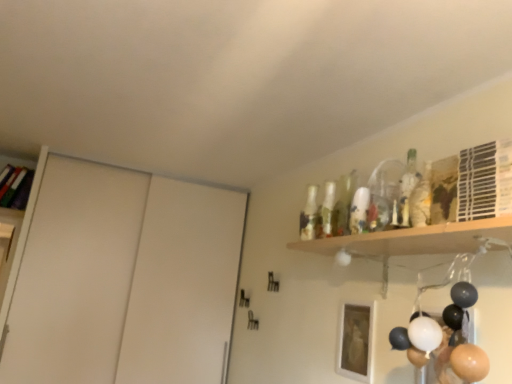
Question: Is white matte picture frame at lower center not inside matte black balloons at lower right?

Choices:
 (A) yes
 (B) no

Answer: (A)

Question: Can you confirm if white matte picture frame at lower center is taller than matte black balloons at lower right?

Choices:
 (A) yes
 (B) no

Answer: (B)

Question: From a real-world perspective, is white matte picture frame at lower center under matte black balloons at lower right?

Choices:
 (A) no
 (B) yes

Answer: (B)

Question: Considering the relative positions of white matte picture frame at lower center and matte black balloons at lower right in the image provided, is white matte picture frame at lower center to the left of matte black balloons at lower right from the viewer's perspective?

Choices:
 (A) yes
 (B) no

Answer: (A)

Question: From the image's perspective, would you say white matte picture frame at lower center is shown under matte black balloons at lower right?

Choices:
 (A) yes
 (B) no

Answer: (A)

Question: Is matte black balloons at lower right taller or shorter than white plastic shelf at upper right, which is the first shelf in right-to-left order?

Choices:
 (A) tall
 (B) short

Answer: (A)

Question: From the image's perspective, is matte black balloons at lower right above or below white plastic shelf at upper right, which is counted as the 2th shelf, starting from the left?

Choices:
 (A) below
 (B) above

Answer: (A)

Question: Is point 462,281 positioned closer to the camera than point 459,210?

Choices:
 (A) farther
 (B) closer

Answer: (A)

Question: Is matte black balloons at lower right inside or outside of white plastic shelf at upper right, which is the first shelf in right-to-left order?

Choices:
 (A) inside
 (B) outside

Answer: (B)

Question: Based on their sizes in the image, would you say white matte picture frame at lower center is bigger or smaller than wooden bookshelf at upper left, which ranks as the second shelf in right-to-left order?

Choices:
 (A) big
 (B) small

Answer: (B)

Question: Is point (347, 309) closer or farther from the camera than point (9, 160)?

Choices:
 (A) closer
 (B) farther

Answer: (A)

Question: In the image, is white matte picture frame at lower center on the left side or the right side of wooden bookshelf at upper left, the 1th shelf viewed from the left?

Choices:
 (A) right
 (B) left

Answer: (A)

Question: Relative to wooden bookshelf at upper left, positioned as the 1th shelf in back-to-front order, is white matte picture frame at lower center in front or behind?

Choices:
 (A) behind
 (B) front

Answer: (B)

Question: Visually, is white plastic shelf at upper right, which is counted as the 2th shelf, starting from the left, positioned to the left or to the right of matte black balloons at lower right?

Choices:
 (A) left
 (B) right

Answer: (B)

Question: Is white plastic shelf at upper right, which is counted as the 2th shelf, starting from the left, bigger or smaller than matte black balloons at lower right?

Choices:
 (A) big
 (B) small

Answer: (B)